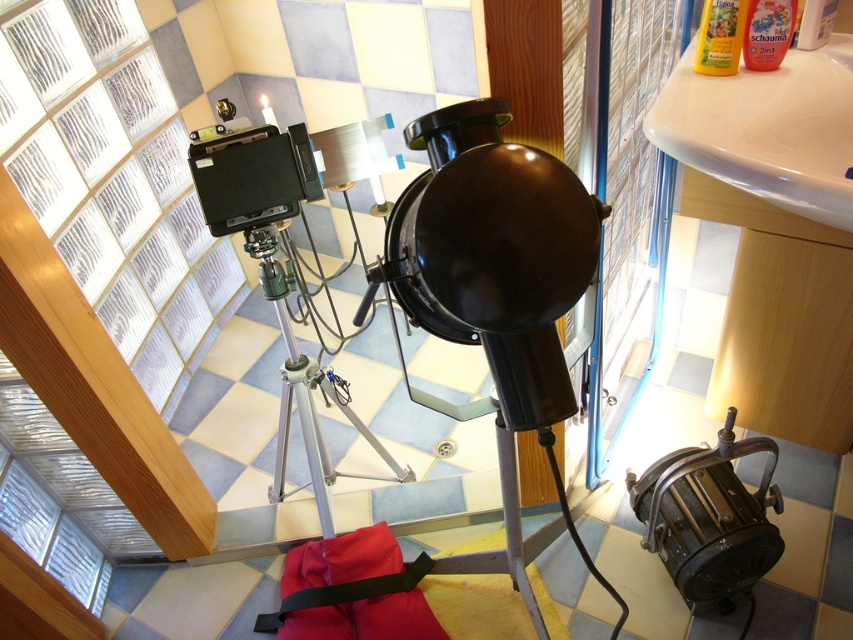
Which of these two, metallic brass lamp at lower right or matte red bag at lower center, stands shorter?

matte red bag at lower center is shorter.

Is metallic brass lamp at lower right to the left of matte red bag at lower center from the viewer's perspective?

Incorrect, metallic brass lamp at lower right is not on the left side of matte red bag at lower center.

Is point (764, 481) farther from camera compared to point (399, 602)?

No, it is in front of (399, 602).

At what (x,y) coordinates should I click in order to perform the action: click on metallic brass lamp at lower right. Please return your answer as a coordinate pair (x, y). Looking at the image, I should click on (709, 516).

Can you confirm if metallic brass lamp at lower right is wider than silver metallic tripod at center?

In fact, metallic brass lamp at lower right might be narrower than silver metallic tripod at center.

This screenshot has height=640, width=853. I want to click on metallic brass lamp at lower right, so click(709, 516).

Measure the distance between point (718, 541) and camera.

The distance of point (718, 541) from camera is 1.45 meters.

Locate an element on the screen. metallic brass lamp at lower right is located at coordinates (709, 516).

Between white glossy sink at upper right and silver metallic tripod at center, which one appears on the left side from the viewer's perspective?

silver metallic tripod at center

Locate an element on the screen. This screenshot has height=640, width=853. white glossy sink at upper right is located at coordinates (767, 129).

What do you see at coordinates (767, 129) in the screenshot? This screenshot has height=640, width=853. I see `white glossy sink at upper right` at bounding box center [767, 129].

You are a GUI agent. You are given a task and a screenshot of the screen. Output one action in this format:
    pyautogui.click(x=<x>, y=<y>)
    Task: Click on the white glossy sink at upper right
    
    Given the screenshot: What is the action you would take?
    pyautogui.click(x=767, y=129)